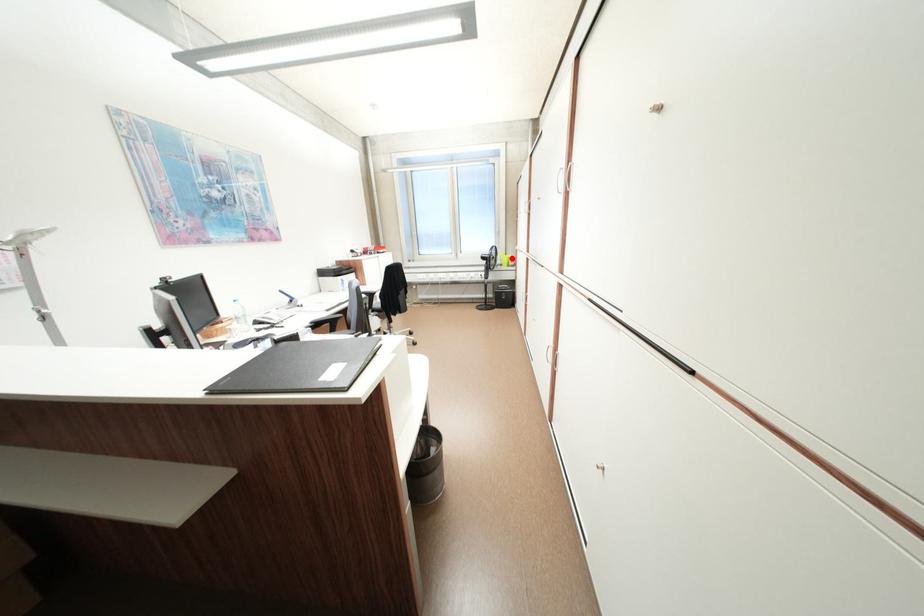
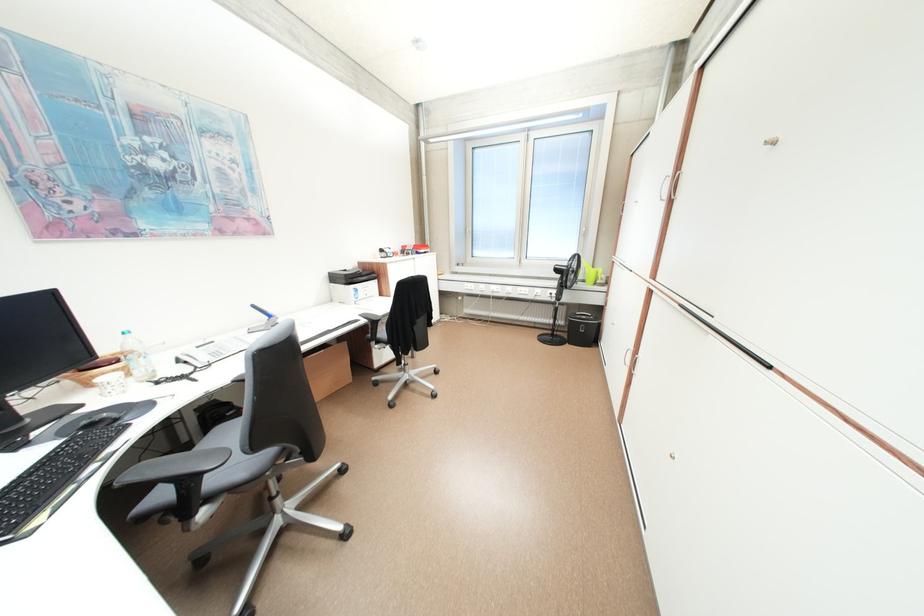
Question: I am providing you with two images of the same scene from different viewpoints. Image1 has a red point marked. In image2, the corresponding 3D location appears at what relative position? Reply with the corresponding letter.

Choices:
 (A) Closer
 (B) Farther

Answer: (B)